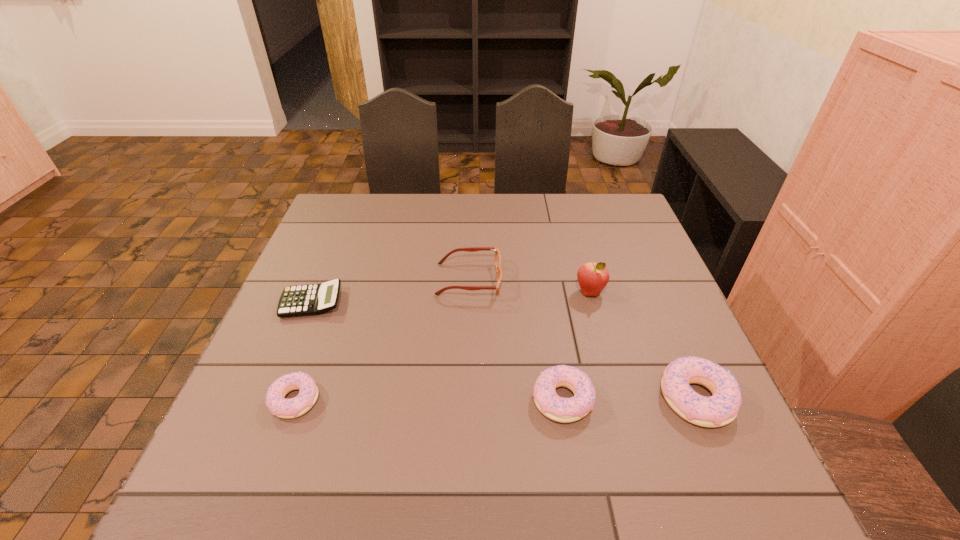
Please determine a free point for an extra doughnut to ensure balance. Please provide its 2D coordinates. Your answer should be formatted as a tuple, i.e. [(x, y)], where the tuple contains the x and y coordinates of a point satisfying the conditions above.

[(429, 399)]